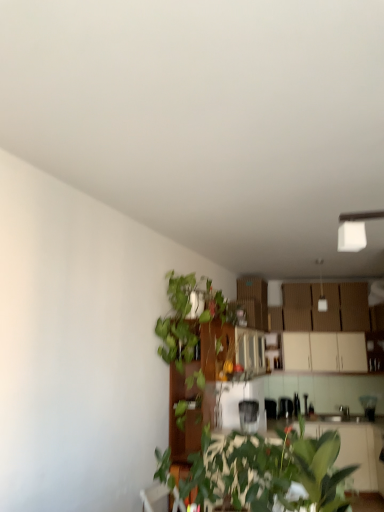
Question: From the image's perspective, is metallic silver kettle at center, arranged as the 3th appliance when viewed from the left, beneath green leafy plant at center?

Choices:
 (A) yes
 (B) no

Answer: (A)

Question: Is metallic silver kettle at center, positioned as the 2th appliance in back-to-front order, next to green leafy plant at center and touching it?

Choices:
 (A) no
 (B) yes

Answer: (A)

Question: Are metallic silver kettle at center, placed as the 2th appliance when sorted from top to bottom, and green leafy plant at center located far from each other?

Choices:
 (A) yes
 (B) no

Answer: (A)

Question: Is metallic silver kettle at center, placed as the 2th appliance when sorted from top to bottom, bigger than green leafy plant at center?

Choices:
 (A) no
 (B) yes

Answer: (A)

Question: Considering the relative sizes of metallic silver kettle at center, the second appliance when ordered from front to back, and green leafy plant at center in the image provided, is metallic silver kettle at center, the second appliance when ordered from front to back, taller than green leafy plant at center?

Choices:
 (A) yes
 (B) no

Answer: (B)

Question: Does metallic silver kettle at center, placed as the 2th appliance when sorted from top to bottom, have a greater width compared to green leafy plant at center?

Choices:
 (A) yes
 (B) no

Answer: (B)

Question: Considering the relative positions of green leafy plant at center and satin silver toaster at center, the 1th appliance positioned from the front, in the image provided, is green leafy plant at center to the left of satin silver toaster at center, the 1th appliance positioned from the front, from the viewer's perspective?

Choices:
 (A) yes
 (B) no

Answer: (A)

Question: From the image's perspective, would you say green leafy plant at center is positioned over satin silver toaster at center, which is counted as the 3th appliance, starting from the bottom?

Choices:
 (A) no
 (B) yes

Answer: (B)

Question: Is green leafy plant at center smaller than satin silver toaster at center, the 1th appliance positioned from the front?

Choices:
 (A) no
 (B) yes

Answer: (A)

Question: Is green leafy plant at center positioned beyond the bounds of satin silver toaster at center, marked as the third appliance in a back-to-front arrangement?

Choices:
 (A) yes
 (B) no

Answer: (A)

Question: Can you see green leafy plant at center touching satin silver toaster at center, the 1th appliance positioned from the front?

Choices:
 (A) no
 (B) yes

Answer: (A)

Question: Is green leafy plant at center wider than satin silver toaster at center, the 1th appliance positioned from the front?

Choices:
 (A) yes
 (B) no

Answer: (A)

Question: Does metallic silver toaster at center, which ranks as the third appliance in front-to-back order, have a lesser height compared to metallic silver kettle at center, arranged as the 3th appliance when viewed from the left?

Choices:
 (A) no
 (B) yes

Answer: (B)